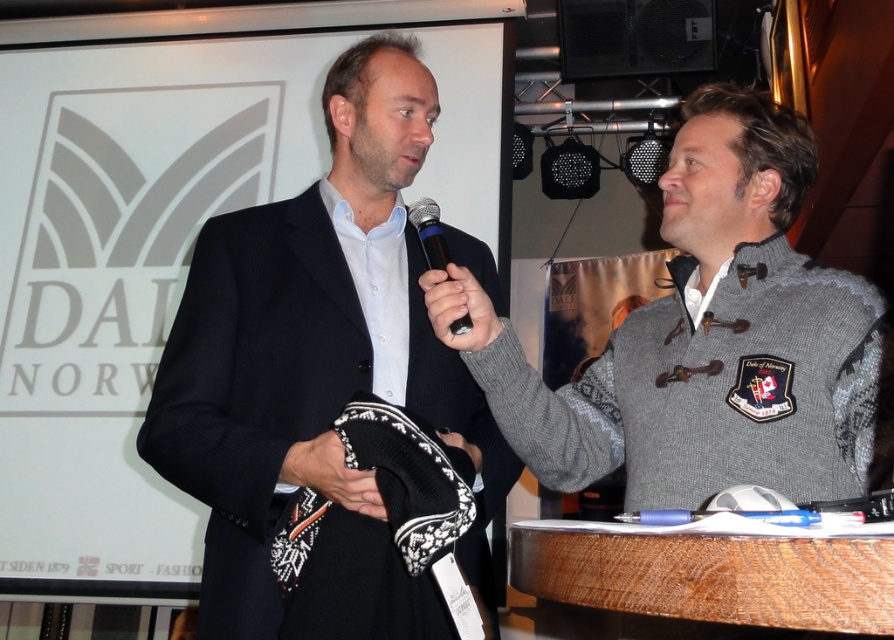
Question: Can you confirm if black matte suit at center is wider than knitted gray sweater at center?

Choices:
 (A) yes
 (B) no

Answer: (B)

Question: Which point is farther from the camera taking this photo?

Choices:
 (A) (180, 356)
 (B) (715, 448)
 (C) (468, 324)

Answer: (A)

Question: Is knitted gray sweater at center smaller than black plastic microphone at center?

Choices:
 (A) yes
 (B) no

Answer: (B)

Question: Is knitted gray sweater at center bigger than black plastic microphone at center?

Choices:
 (A) no
 (B) yes

Answer: (B)

Question: Which object is farther from the camera taking this photo?

Choices:
 (A) knitted gray sweater at center
 (B) black plastic microphone at center
 (C) black matte suit at center

Answer: (B)

Question: Which object is the farthest from the black matte suit at center?

Choices:
 (A) black plastic microphone at center
 (B) knitted gray sweater at center

Answer: (B)